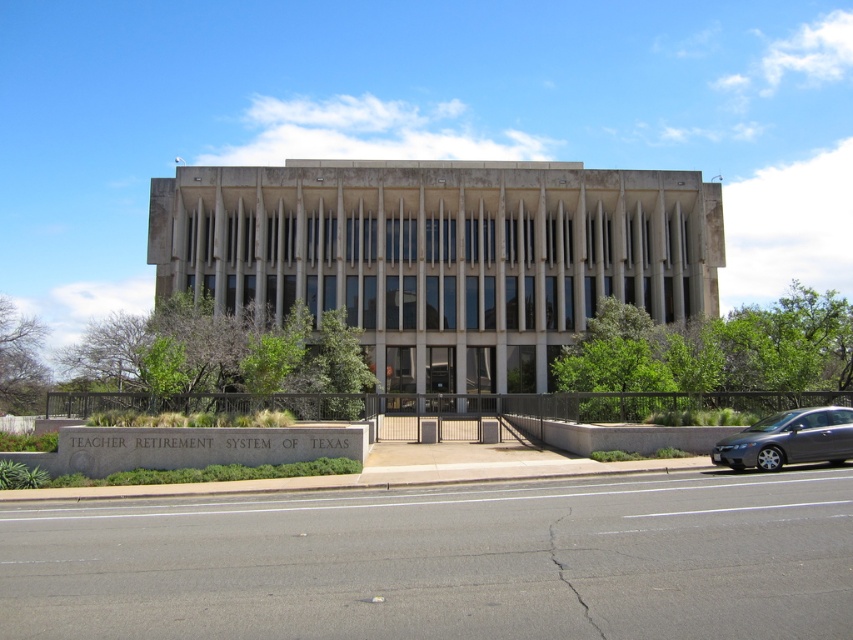
Which of these two, asphalt at lower center or silver metallic sedan at lower right, stands shorter?

Standing shorter between the two is silver metallic sedan at lower right.

Is point (589, 604) positioned after point (792, 412)?

No, (589, 604) is in front of (792, 412).

Which is behind, point (384, 624) or point (787, 444)?

The point (787, 444) is behind.

The height and width of the screenshot is (640, 853). What are the coordinates of `asphalt at lower center` in the screenshot? It's located at (444, 561).